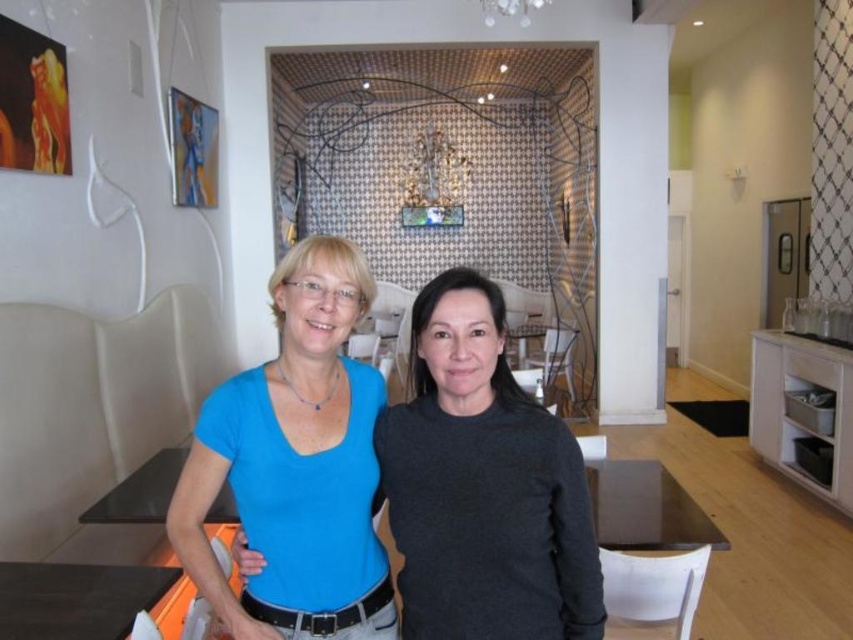
Does dark gray sweater at center have a greater height compared to dark wood table at lower left?

Yes, dark gray sweater at center is taller than dark wood table at lower left.

Is point (509, 604) in front of point (134, 570)?

Yes, it is.

Is point (384, 440) positioned in front of point (115, 577)?

Yes, point (384, 440) is in front of point (115, 577).

The image size is (853, 640). In order to click on dark gray sweater at center in this screenshot , I will do `click(482, 484)`.

Can you confirm if matte blue shirt at center is positioned above dark wood table at lower left?

Correct, matte blue shirt at center is located above dark wood table at lower left.

Based on the photo, can you confirm if matte blue shirt at center is bigger than dark wood table at lower left?

Yes.

Which is in front, point (368, 304) or point (154, 595)?

Point (368, 304) is more forward.

Find the location of `matte blue shirt at center`. matte blue shirt at center is located at coordinates (294, 465).

Between dark gray sweater at center and matte blue shirt at center, which one has less height?

With less height is dark gray sweater at center.

Can you confirm if dark gray sweater at center is wider than matte blue shirt at center?

Yes.

Image resolution: width=853 pixels, height=640 pixels. Identify the location of dark gray sweater at center. (482, 484).